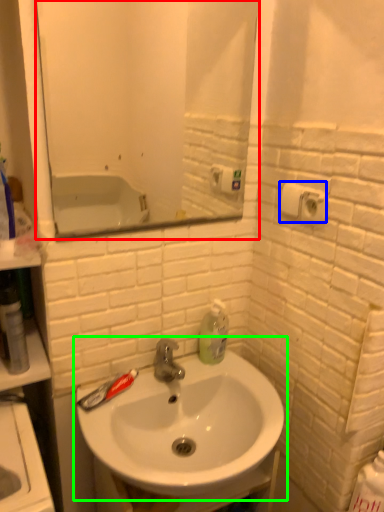
Question: Which object is the closest to the mirror (highlighted by a red box)? Choose among these: toilet paper (highlighted by a blue box) or sink (highlighted by a green box).

Choices:
 (A) toilet paper
 (B) sink

Answer: (B)